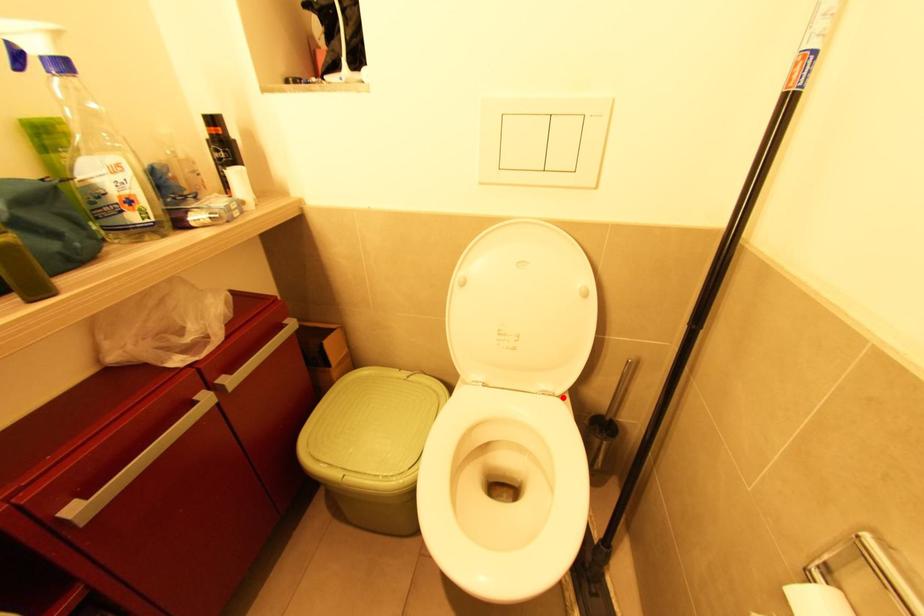
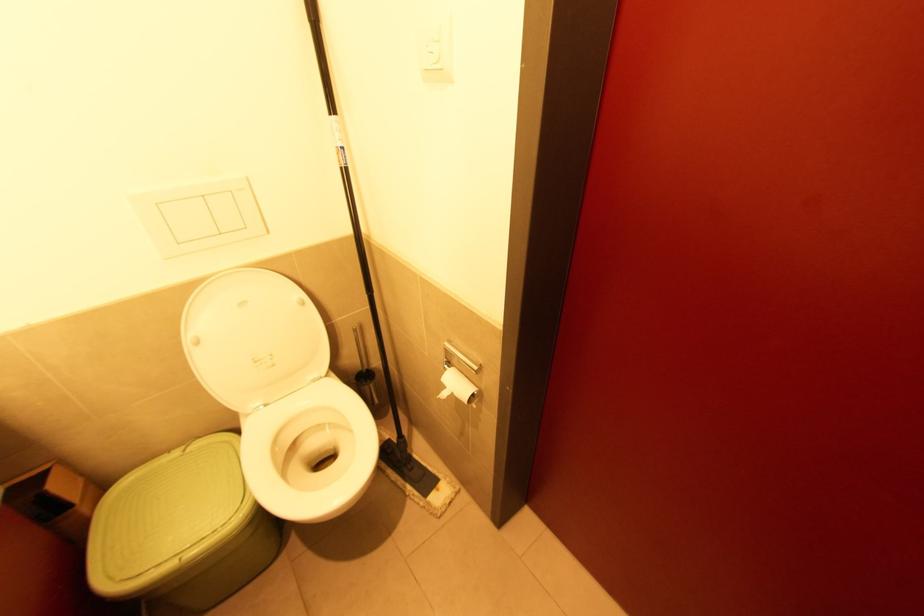
Question: I am providing you with two images of the same scene from different viewpoints. A red point is shown in image1. For the corresponding object point in image2, is it positioned nearer or farther from the camera?

Choices:
 (A) Nearer
 (B) Farther

Answer: (A)